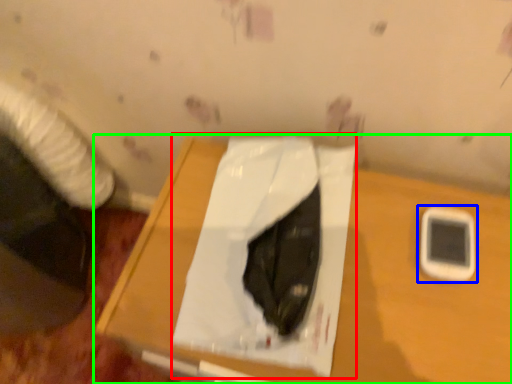
Question: Estimate the real-world distances between objects in this image. Which object is closer to sheet (highlighted by a red box), mobile phone (highlighted by a blue box) or table (highlighted by a green box)?

Choices:
 (A) mobile phone
 (B) table

Answer: (B)